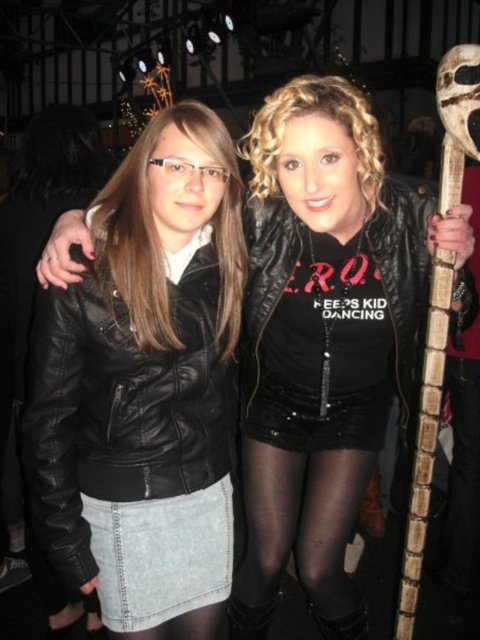
Is black leather jacket at left to the right of denim skirt at lower left from the viewer's perspective?

No, black leather jacket at left is not to the right of denim skirt at lower left.

Who is lower down, black leather jacket at left or denim skirt at lower left?

denim skirt at lower left

Which is in front, point (108, 289) or point (156, 548)?

Point (108, 289) is more forward.

In order to click on black leather jacket at left in this screenshot , I will do `click(140, 342)`.

Which is in front, point (130, 513) or point (360, 182)?

Point (130, 513) is more forward.

What are the coordinates of `denim skirt at lower left` in the screenshot? It's located at (160, 556).

Which is above, black leather jacket at left or matte black leather jacket at center?

matte black leather jacket at center is above.

Is black leather jacket at left bigger than matte black leather jacket at center?

Actually, black leather jacket at left might be smaller than matte black leather jacket at center.

Does point (207, 413) come farther from viewer compared to point (370, 120)?

Yes, it is behind point (370, 120).

The image size is (480, 640). In order to click on black leather jacket at left in this screenshot , I will do `click(140, 342)`.